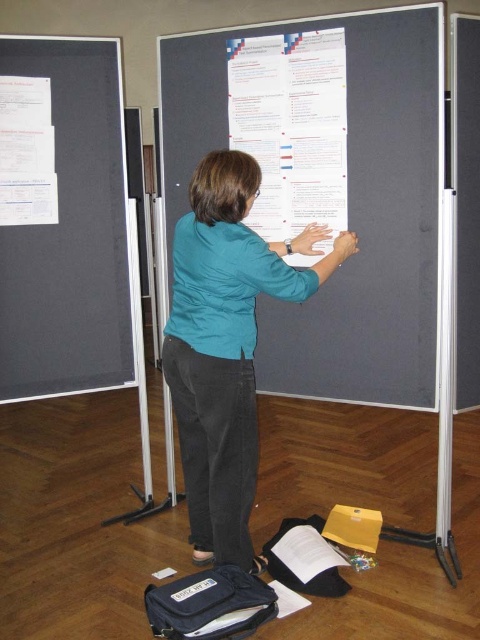
Describe the element at coordinates (334, 202) in the screenshot. I see `matte gray poster at center` at that location.

Which of these two, matte gray poster at center or dark gray matte board at left, stands shorter?

Standing shorter between the two is dark gray matte board at left.

Locate an element on the screen. matte gray poster at center is located at coordinates (334, 202).

The width and height of the screenshot is (480, 640). Find the location of `matte gray poster at center`. matte gray poster at center is located at coordinates pyautogui.click(x=334, y=202).

Is matte gray poster at center closer to the viewer compared to white paper at upper left?

Yes, it is.

Does matte gray poster at center appear on the right side of white paper at upper left?

Indeed, matte gray poster at center is positioned on the right side of white paper at upper left.

The image size is (480, 640). What are the coordinates of `matte gray poster at center` in the screenshot? It's located at (334, 202).

How far apart are teal fabric shirt at center and white paper at center?

22.14 inches

Who is shorter, teal fabric shirt at center or white paper at center?

With less height is white paper at center.

Who is more distant from viewer, (180, 230) or (251, 38)?

Positioned behind is point (251, 38).

In order to click on teal fabric shirt at center in this screenshot , I will do `click(227, 344)`.